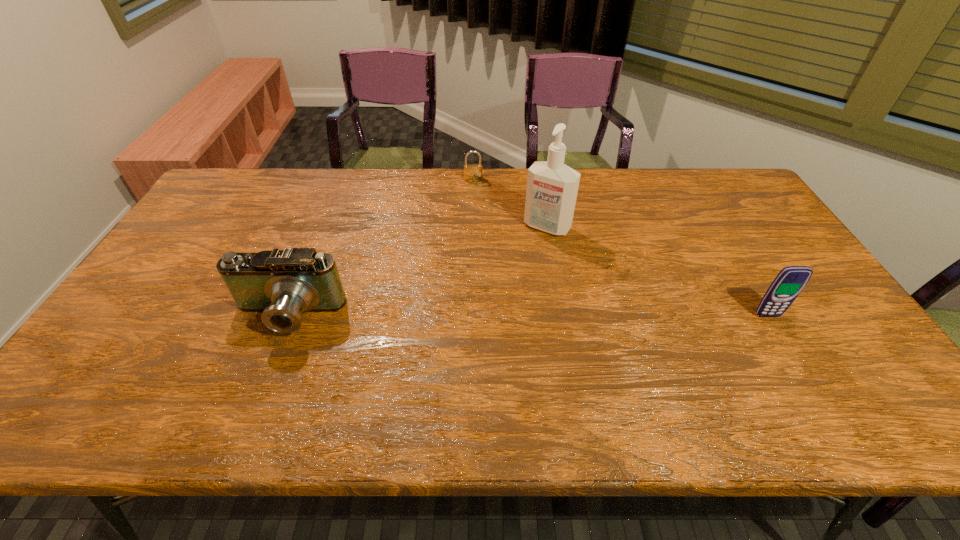
Locate which object ranks second in proximity to the camcorder. Please provide its 2D coordinates. Your answer should be formatted as a tuple, i.e. [(x, y)], where the tuple contains the x and y coordinates of a point satisfying the conditions above.

[(472, 172)]

You are a GUI agent. You are given a task and a screenshot of the screen. Output one action in this format:
    pyautogui.click(x=<x>, y=<y>)
    Task: Click on the object that stands as the second closest to the cellular telephone
    Image resolution: width=960 pixels, height=540 pixels.
    Given the screenshot: What is the action you would take?
    pyautogui.click(x=472, y=172)